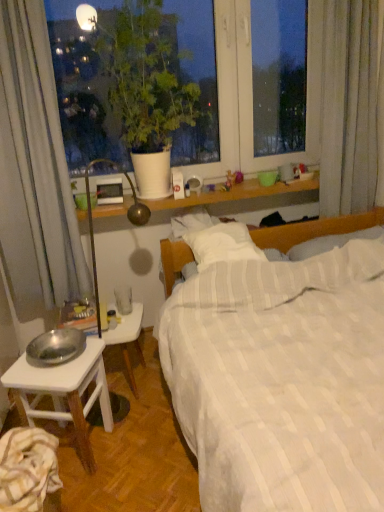
Question: Considering the positions of striped cotton sheet at lower left and white matte plant pot at upper left in the image, is striped cotton sheet at lower left wider or thinner than white matte plant pot at upper left?

Choices:
 (A) wide
 (B) thin

Answer: (B)

Question: Is point (46, 448) closer or farther from the camera than point (150, 104)?

Choices:
 (A) farther
 (B) closer

Answer: (B)

Question: Estimate the real-world distances between objects in this image. Which object is closer to the white striped fabric at center?

Choices:
 (A) white wooden table at lower left
 (B) white matte plant pot at upper left
 (C) silver metallic bowl at lower left
 (D) white soft pillow at center
 (E) striped cotton sheet at lower left

Answer: (C)

Question: Based on their relative distances, which object is nearer to the metallic silver bowl at lower left?

Choices:
 (A) silver metallic bowl at lower left
 (B) white striped fabric at center
 (C) striped cotton sheet at lower left
 (D) white soft pillow at center
 (E) white matte plant pot at upper left

Answer: (A)